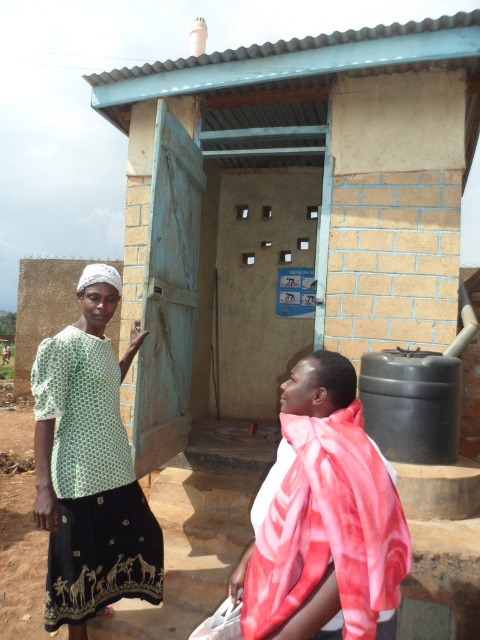
Question: Is green dotted blouse at center below floral silk scarf at lower right?

Choices:
 (A) yes
 (B) no

Answer: (A)

Question: Which point is farther from the camera taking this photo?

Choices:
 (A) (96, 358)
 (B) (276, 525)

Answer: (A)

Question: Can you confirm if green dotted blouse at center is smaller than floral silk scarf at lower right?

Choices:
 (A) yes
 (B) no

Answer: (B)

Question: Considering the relative positions of green dotted blouse at center and floral silk scarf at lower right in the image provided, where is green dotted blouse at center located with respect to floral silk scarf at lower right?

Choices:
 (A) left
 (B) right

Answer: (A)